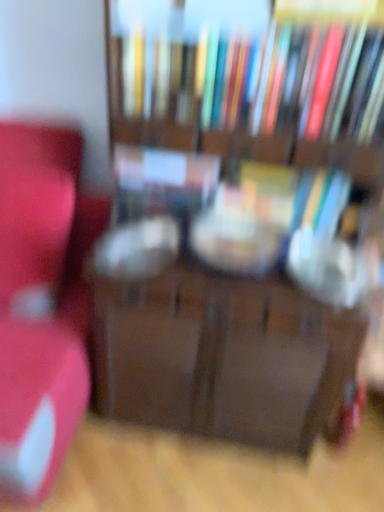
Question: Is matte red chair at left shorter than matte plastic book at center, which is the 2th book from bottom to top?

Choices:
 (A) no
 (B) yes

Answer: (A)

Question: Is matte red chair at left at the right side of matte plastic book at center, which is the second book in top-to-bottom order?

Choices:
 (A) yes
 (B) no

Answer: (B)

Question: Does matte red chair at left have a smaller size compared to matte plastic book at center, which is the second book in top-to-bottom order?

Choices:
 (A) yes
 (B) no

Answer: (B)

Question: Considering the relative sizes of matte red chair at left and matte plastic book at center, which is the second book in top-to-bottom order, in the image provided, is matte red chair at left taller than matte plastic book at center, which is the second book in top-to-bottom order,?

Choices:
 (A) yes
 (B) no

Answer: (A)

Question: Considering the relative sizes of matte red chair at left and matte plastic book at center, which is the second book in top-to-bottom order, in the image provided, is matte red chair at left wider than matte plastic book at center, which is the second book in top-to-bottom order,?

Choices:
 (A) yes
 (B) no

Answer: (A)

Question: In terms of width, does hardcover books at upper center, the 3th book from the bottom, look wider or thinner when compared to hardcover book at center, which is the third book from top to bottom?

Choices:
 (A) thin
 (B) wide

Answer: (B)

Question: Is point (339, 105) closer or farther from the camera than point (311, 190)?

Choices:
 (A) farther
 (B) closer

Answer: (B)

Question: Is hardcover books at upper center, the 3th book from the bottom, in front of or behind hardcover book at center, arranged as the 1th book when ordered from the bottom, in the image?

Choices:
 (A) behind
 (B) front

Answer: (B)

Question: Is hardcover books at upper center, which ranks as the 1th book in top-to-bottom order, taller or shorter than hardcover book at center, arranged as the 1th book when ordered from the bottom?

Choices:
 (A) short
 (B) tall

Answer: (B)

Question: Is matte red chair at left situated inside wooden bookcase at center or outside?

Choices:
 (A) outside
 (B) inside

Answer: (A)

Question: From a real-world perspective, is matte red chair at left positioned above or below wooden bookcase at center?

Choices:
 (A) below
 (B) above

Answer: (A)

Question: Considering the relative positions of matte red chair at left and wooden bookcase at center in the image provided, is matte red chair at left to the left or to the right of wooden bookcase at center?

Choices:
 (A) left
 (B) right

Answer: (A)

Question: Considering the positions of point (39, 474) and point (367, 150), is point (39, 474) closer or farther from the camera than point (367, 150)?

Choices:
 (A) farther
 (B) closer

Answer: (A)

Question: Would you say matte red chair at left is to the left or to the right of matte plastic book at center, which is the second book in top-to-bottom order, in the picture?

Choices:
 (A) left
 (B) right

Answer: (A)

Question: Considering their positions, is matte red chair at left located in front of or behind matte plastic book at center, which is the 2th book from bottom to top?

Choices:
 (A) behind
 (B) front

Answer: (B)